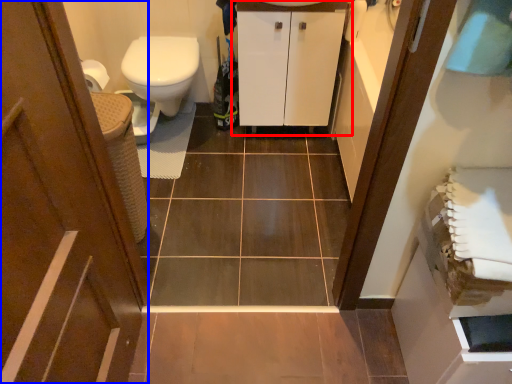
Question: Among these objects, which one is farthest to the camera, bathroom cabinet (highlighted by a red box) or door (highlighted by a blue box)?

Choices:
 (A) bathroom cabinet
 (B) door

Answer: (A)